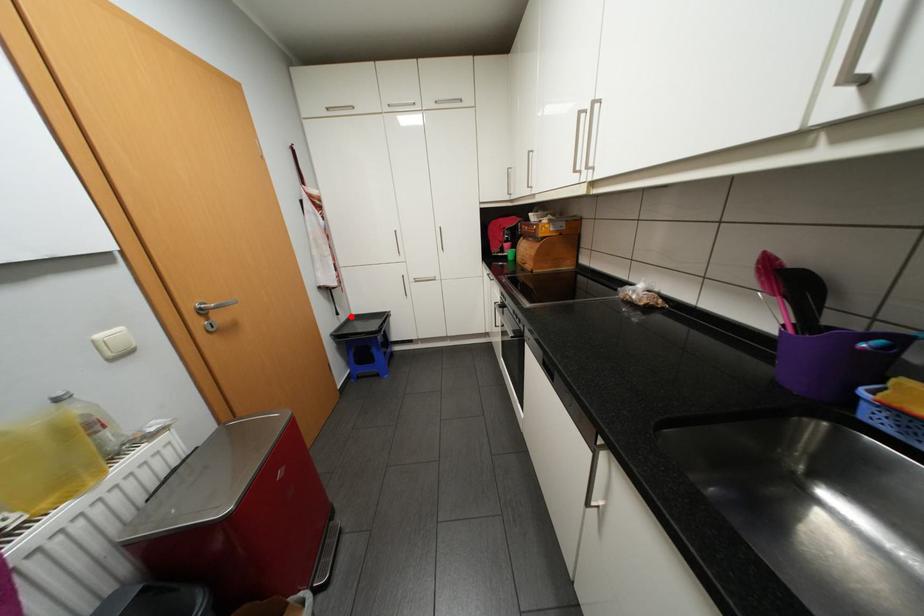
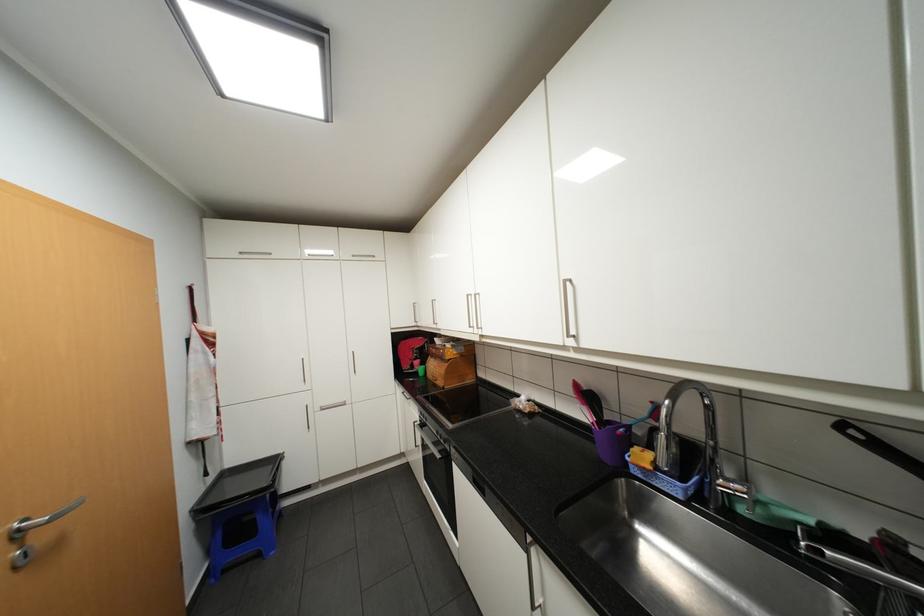
Question: A red point is marked in image1. In image2, is the corresponding 3D point closer to the camera or farther? Reply with the corresponding letter.

Choices:
 (A) The corresponding 3D point is closer.
 (B) The corresponding 3D point is farther.

Answer: (B)